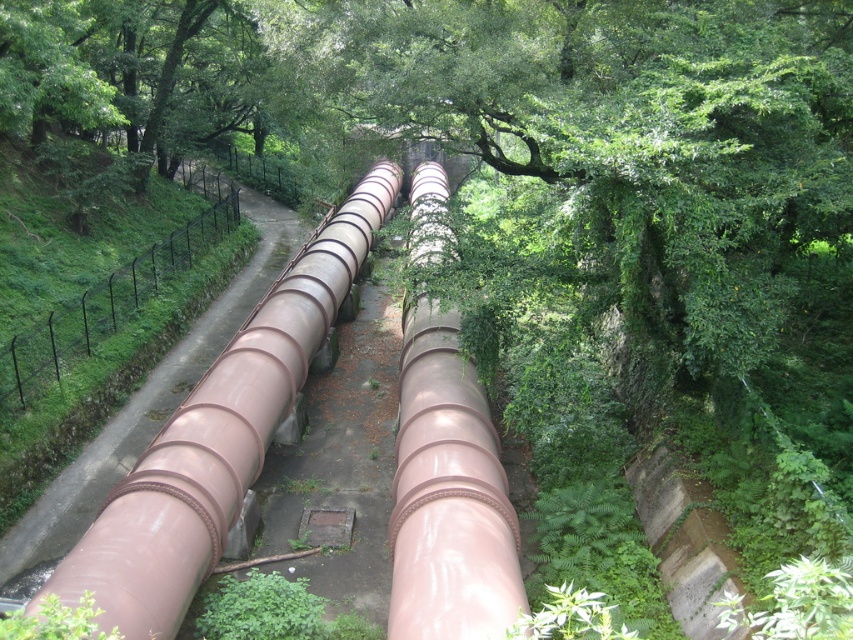
Is glossy metallic pipe at center to the left of black metal fence at left from the viewer's perspective?

No, glossy metallic pipe at center is not to the left of black metal fence at left.

Does point (154, 531) come behind point (111, 300)?

No, (154, 531) is closer to viewer.

Image resolution: width=853 pixels, height=640 pixels. Identify the location of glossy metallic pipe at center. (218, 436).

Where is `glossy metallic pipe at center`? glossy metallic pipe at center is located at coordinates (218, 436).

Does point (199, 570) lie in front of point (456, 568)?

No, it is behind (456, 568).

Between glossy metallic pipe at center and glossy metallic water pipe at center, which one appears on the right side from the viewer's perspective?

glossy metallic water pipe at center

Where is `glossy metallic pipe at center`? The width and height of the screenshot is (853, 640). glossy metallic pipe at center is located at coordinates (218, 436).

Identify the location of glossy metallic water pipe at center. (448, 493).

Who is more forward, (424, 492) or (199, 234)?

Point (424, 492)

The width and height of the screenshot is (853, 640). What are the coordinates of `glossy metallic water pipe at center` in the screenshot? It's located at (448, 493).